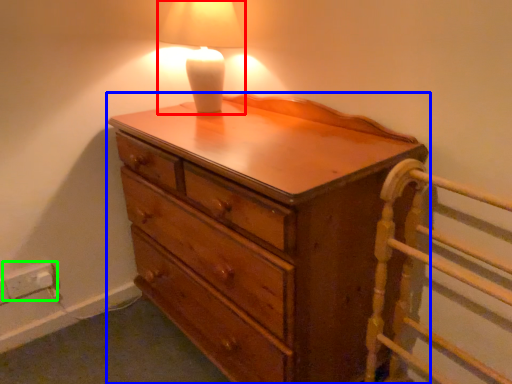
Question: Based on their relative distances, which object is farther from lamp (highlighted by a red box)? Choose from chest of drawers (highlighted by a blue box) and electric outlet (highlighted by a green box).

Choices:
 (A) chest of drawers
 (B) electric outlet

Answer: (B)